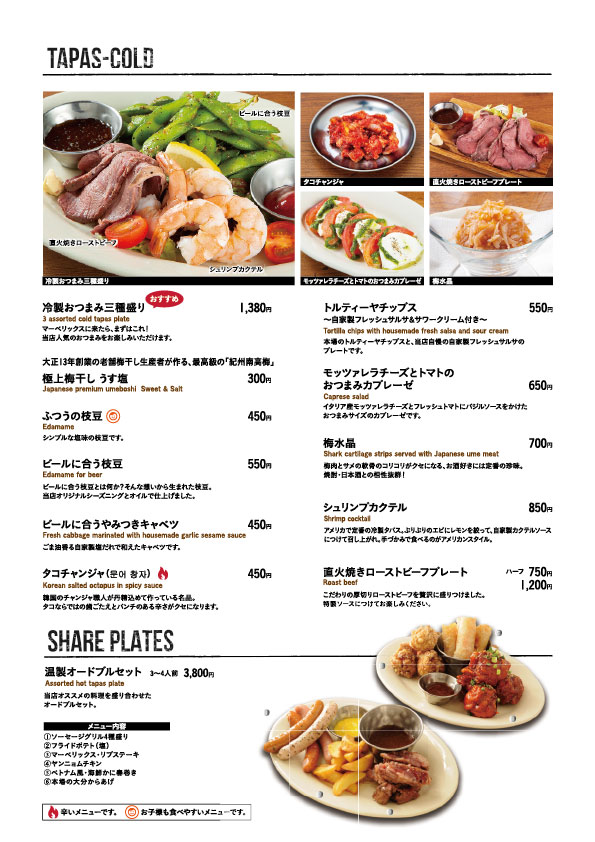
You are a GUI agent. You are given a task and a screenshot of the screen. Output one action in this format:
    pyautogui.click(x=<x>, y=<y>)
    Task: Click on the plates
    
    Given the screenshot: What is the action you would take?
    (x=131, y=642)